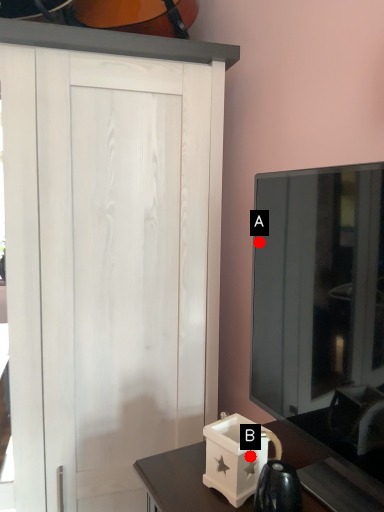
Question: Two points are circled on the image, labeled by A and B beside each circle. Which point appears farthest from the camera in this image?

Choices:
 (A) A is further
 (B) B is further

Answer: (A)